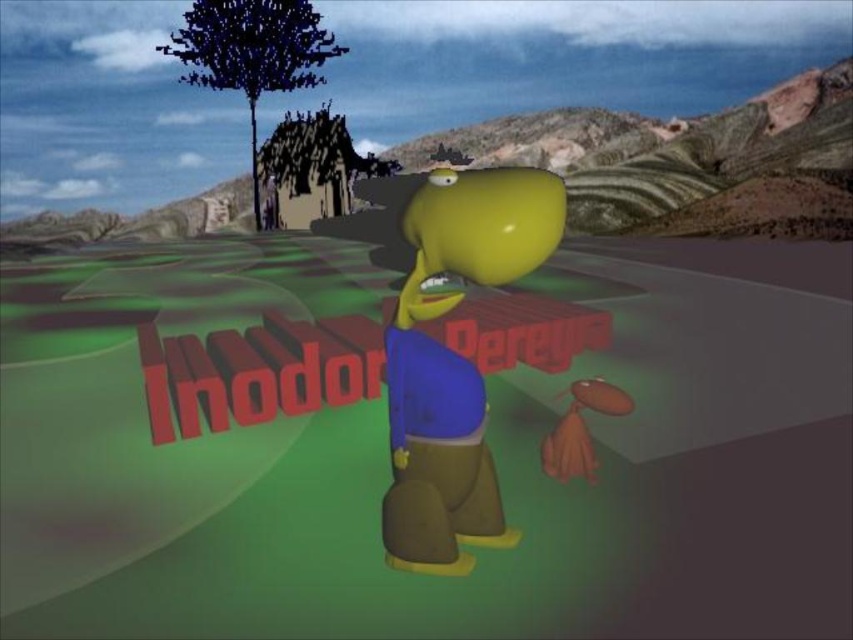
Question: Does rubber yellow head at center have a larger size compared to dark green textured tree at upper left?

Choices:
 (A) no
 (B) yes

Answer: (A)

Question: Can you confirm if rubber yellow head at center is wider than dark green textured tree at upper left?

Choices:
 (A) yes
 (B) no

Answer: (B)

Question: Can you confirm if rubber yellow head at center is bigger than dark green textured tree at upper left?

Choices:
 (A) yes
 (B) no

Answer: (B)

Question: Which of the following is the closest to the observer?

Choices:
 (A) rubber yellow head at center
 (B) dark green textured tree at upper left

Answer: (A)

Question: Which point appears closest to the camera in this image?

Choices:
 (A) (257, 188)
 (B) (408, 333)

Answer: (B)